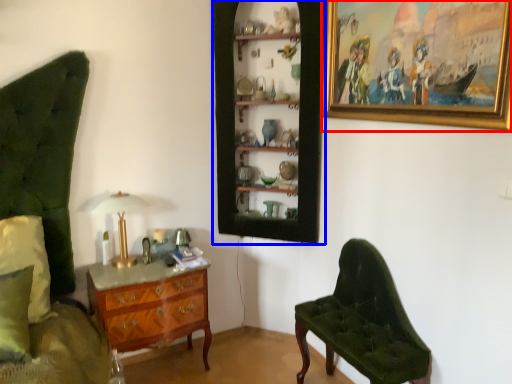
Question: Which object is closer to the camera taking this photo, picture frame (highlighted by a red box) or shelf (highlighted by a blue box)?

Choices:
 (A) picture frame
 (B) shelf

Answer: (A)